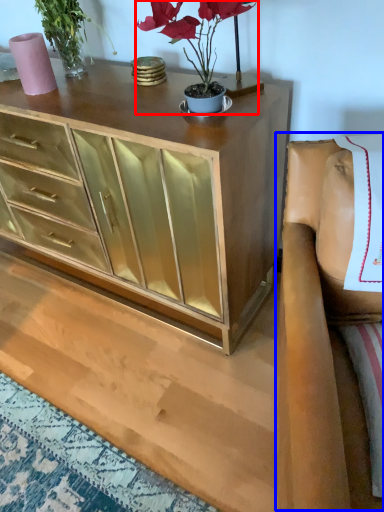
Question: Among these objects, which one is farthest to the camera, houseplant (highlighted by a red box) or armchair (highlighted by a blue box)?

Choices:
 (A) houseplant
 (B) armchair

Answer: (A)